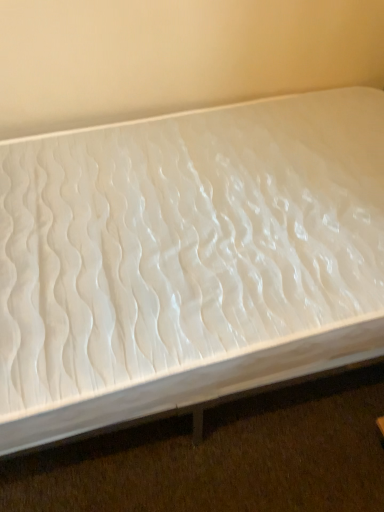
The image size is (384, 512). Describe the element at coordinates (192, 257) in the screenshot. I see `white textured mattress at center` at that location.

Where is `white textured mattress at center`? Image resolution: width=384 pixels, height=512 pixels. white textured mattress at center is located at coordinates (192, 257).

The width and height of the screenshot is (384, 512). Identify the location of white textured mattress at center. (192, 257).